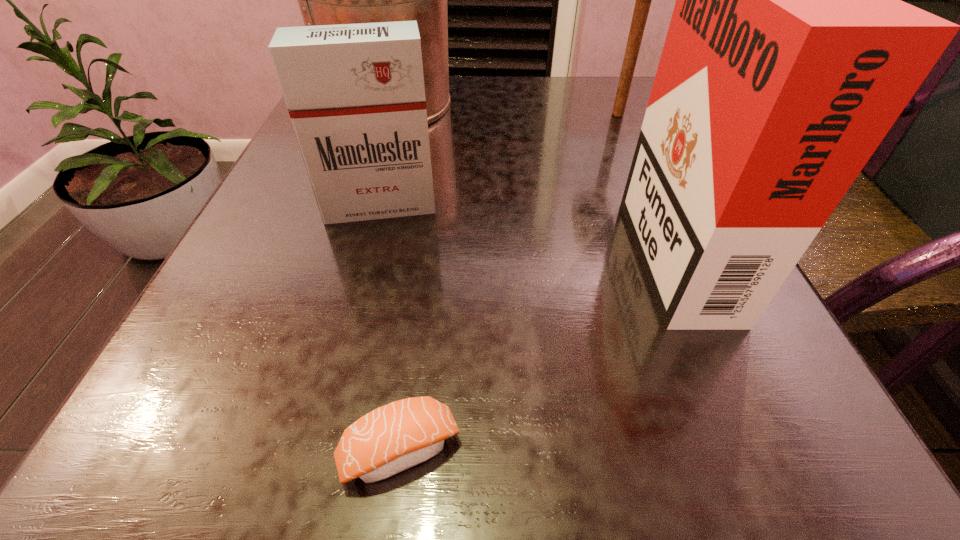
In order to click on cigarette case located at the right edge in this screenshot , I will do `click(789, 56)`.

The width and height of the screenshot is (960, 540). Identify the location of object that is at the far left corner. (323, 0).

Find the location of `object that is at the far right corner`. object that is at the far right corner is located at coordinates (643, 0).

Find the location of a particular element. vacant space at the far edge is located at coordinates (513, 79).

What are the coordinates of `vacant space at the near edge` in the screenshot? It's located at (297, 477).

The width and height of the screenshot is (960, 540). Identify the location of vacant space at the left edge of the desktop. (254, 311).

Where is `free region at the right edge`? free region at the right edge is located at coordinates (727, 333).

In the image, there is a desktop. Identify the location of vacant space at the far right corner. (577, 96).

This screenshot has height=540, width=960. I want to click on vacant region between the taller cigarette case and the bucket, so (530, 173).

Where is `free point between the left cigarette case and the taller cigarette case`? This screenshot has height=540, width=960. free point between the left cigarette case and the taller cigarette case is located at coordinates pyautogui.click(x=525, y=224).